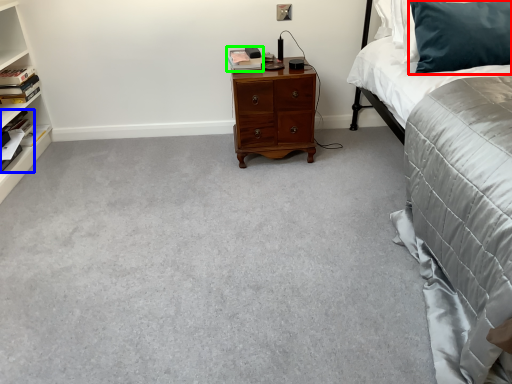
Question: Which is farther away from pillow (highlighted by a red box)? book (highlighted by a blue box) or book (highlighted by a green box)?

Choices:
 (A) book
 (B) book

Answer: (A)